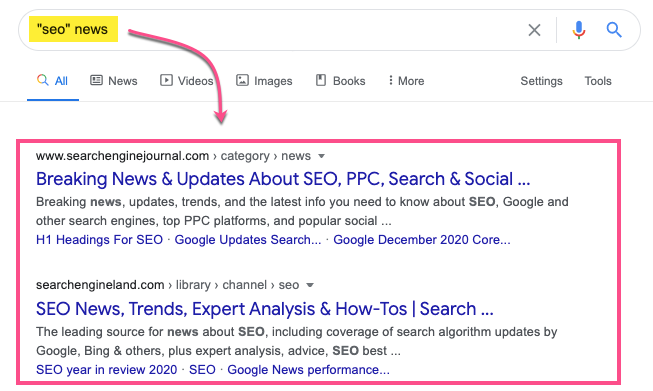
Where is `bar tools`? The image size is (653, 391). bar tools is located at coordinates coord(616,82).